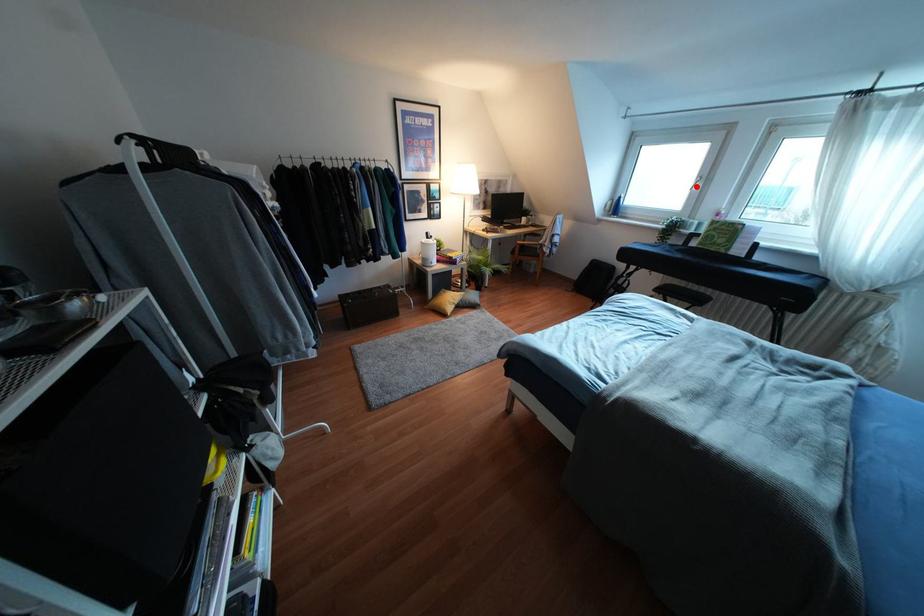
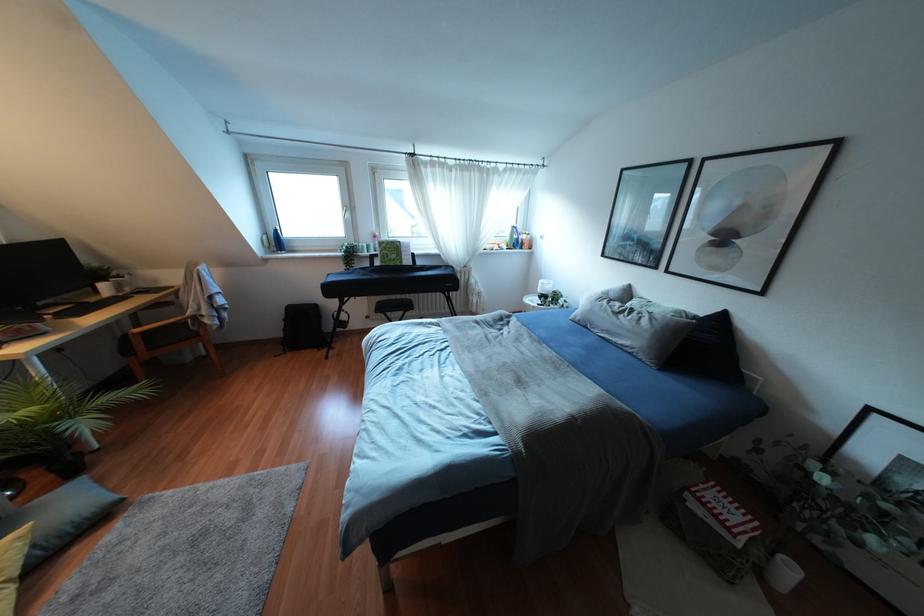
Find the pixel in the second image that matches the highlighted location in the first image.

(346, 215)